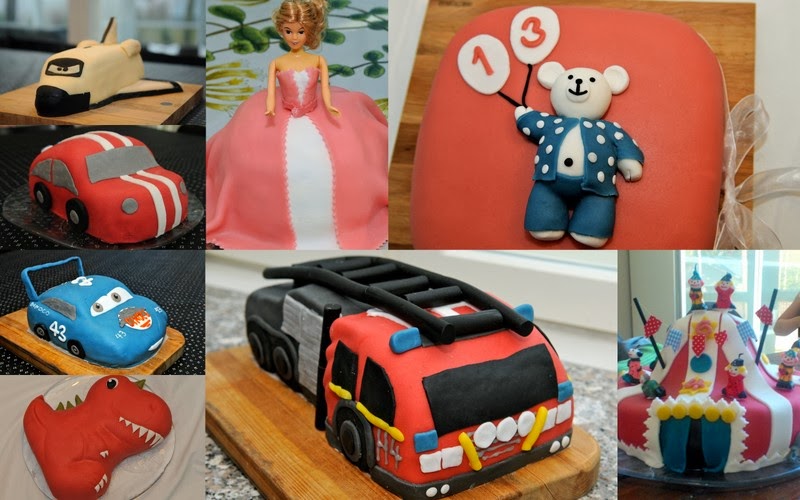
Where is `doll`? This screenshot has height=500, width=800. doll is located at coordinates (300, 53).